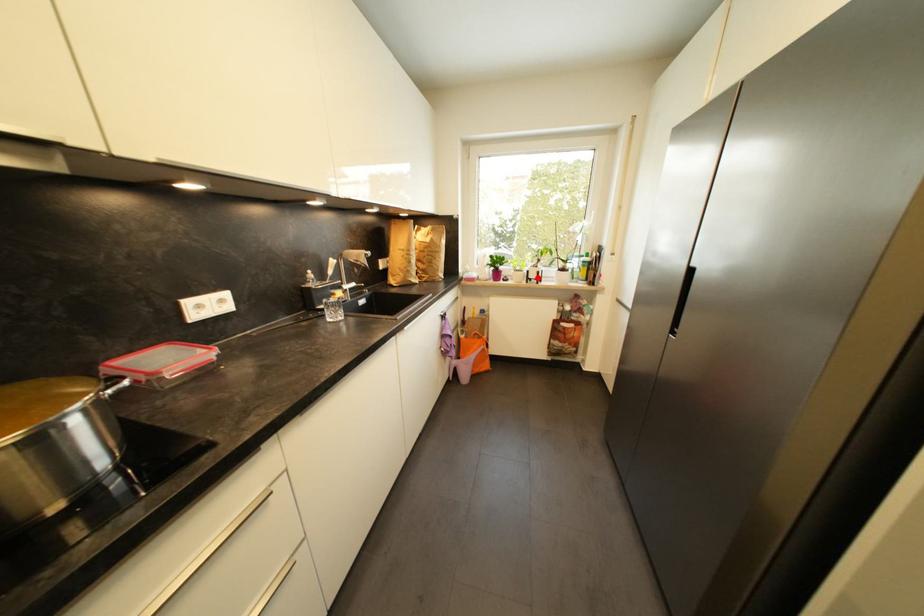
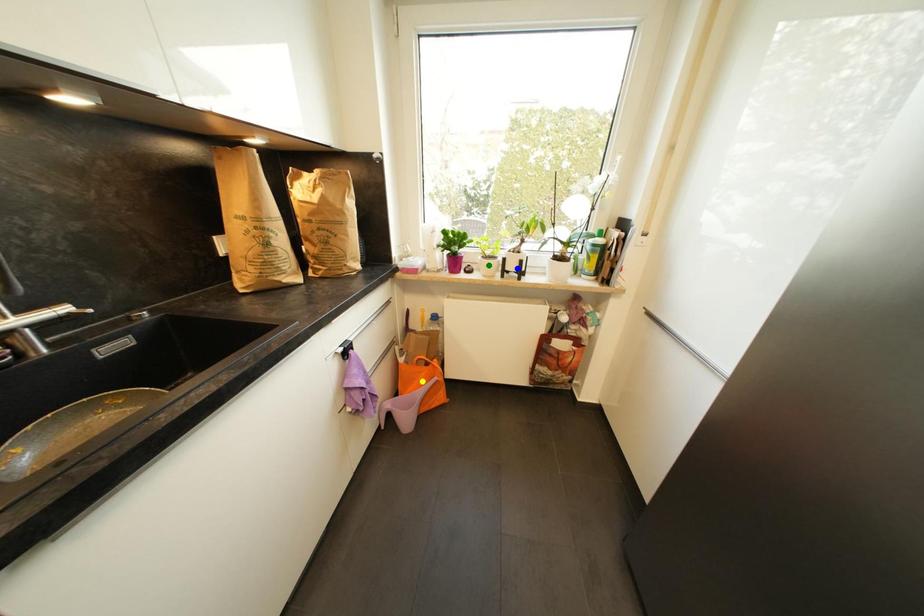
Question: I am providing you with two images of the same scene from different viewpoints. A red point is marked on the first image. You are given multiple points on the second image. Which spot in image 2 lines up with the point in image 1?

Choices:
 (A) green point
 (B) yellow point
 (C) blue point

Answer: (C)